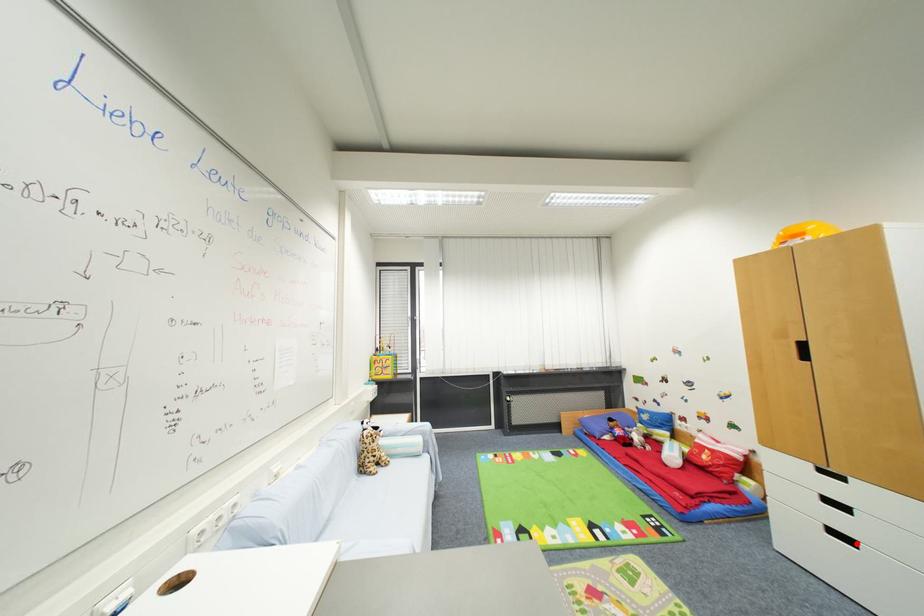
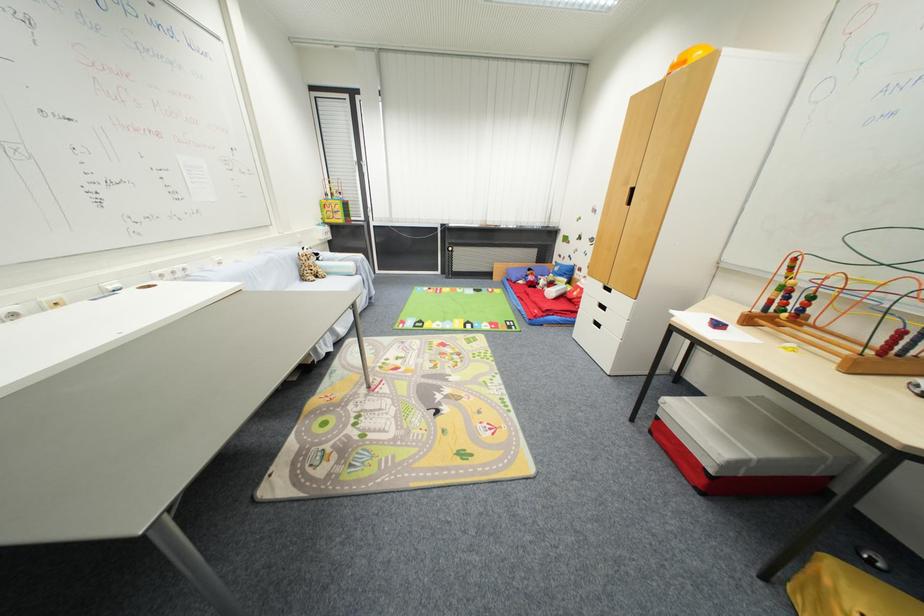
Question: I am providing you with two images of the same scene from different viewpoints. Given a red point in image1, look at the same physical point in image2. Is it:

Choices:
 (A) Closer to the viewpoint
 (B) Farther from the viewpoint

Answer: (B)